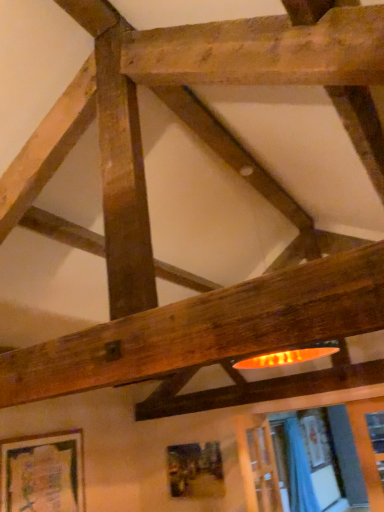
Question: Considering the relative sizes of wooden textured picture frame at lower center, acting as the second picture frame starting from the left, and blue fabric curtain at lower right in the image provided, is wooden textured picture frame at lower center, acting as the second picture frame starting from the left, bigger than blue fabric curtain at lower right?

Choices:
 (A) yes
 (B) no

Answer: (B)

Question: Is wooden textured picture frame at lower center, which is the 1th picture frame from back to front, positioned before blue fabric curtain at lower right?

Choices:
 (A) no
 (B) yes

Answer: (B)

Question: Is wooden textured picture frame at lower center, acting as the second picture frame starting from the left, shorter than blue fabric curtain at lower right?

Choices:
 (A) no
 (B) yes

Answer: (B)

Question: Are wooden textured picture frame at lower center, acting as the second picture frame starting from the left, and blue fabric curtain at lower right located far from each other?

Choices:
 (A) no
 (B) yes

Answer: (A)

Question: Is wooden textured picture frame at lower center, acting as the second picture frame starting from the left, further to camera compared to blue fabric curtain at lower right?

Choices:
 (A) yes
 (B) no

Answer: (B)

Question: Considering the relative sizes of wooden textured picture frame at lower center, acting as the second picture frame starting from the left, and blue fabric curtain at lower right in the image provided, is wooden textured picture frame at lower center, acting as the second picture frame starting from the left, taller than blue fabric curtain at lower right?

Choices:
 (A) yes
 (B) no

Answer: (B)

Question: Is wooden textured picture frame at lower center, which is the 1th picture frame from right to left, outside of wooden frame at lower left, the 1th picture frame positioned from the front?

Choices:
 (A) no
 (B) yes

Answer: (B)

Question: Is wooden textured picture frame at lower center, acting as the second picture frame starting from the left, touching wooden frame at lower left, placed as the second picture frame when sorted from right to left?

Choices:
 (A) no
 (B) yes

Answer: (A)

Question: Does wooden textured picture frame at lower center, arranged as the 2th picture frame when viewed from the front, have a larger size compared to wooden frame at lower left, acting as the 1th picture frame starting from the left?

Choices:
 (A) yes
 (B) no

Answer: (B)

Question: Is wooden textured picture frame at lower center, arranged as the 2th picture frame when viewed from the front, oriented towards wooden frame at lower left, acting as the 1th picture frame starting from the left?

Choices:
 (A) yes
 (B) no

Answer: (A)

Question: Is the depth of wooden textured picture frame at lower center, acting as the second picture frame starting from the left, less than that of wooden frame at lower left, acting as the 1th picture frame starting from the left?

Choices:
 (A) no
 (B) yes

Answer: (A)

Question: From the image's perspective, would you say wooden textured picture frame at lower center, acting as the second picture frame starting from the left, is positioned over wooden frame at lower left, acting as the 1th picture frame starting from the left?

Choices:
 (A) no
 (B) yes

Answer: (A)

Question: Is blue fabric curtain at lower right located outside wooden textured picture frame at lower center, which is the 1th picture frame from back to front?

Choices:
 (A) no
 (B) yes

Answer: (B)